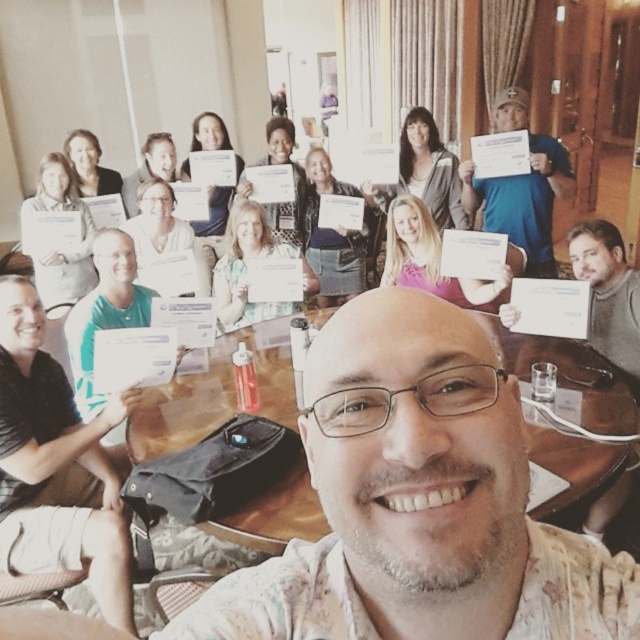
Does black shirt at lower left appear on the right side of green matte shirt at center?

No, black shirt at lower left is not to the right of green matte shirt at center.

Between black shirt at lower left and green matte shirt at center, which one is positioned lower?

black shirt at lower left

Does point (104, 564) come closer to viewer compared to point (93, 252)?

Yes, point (104, 564) is in front of point (93, 252).

Locate an element on the screen. The width and height of the screenshot is (640, 640). black shirt at lower left is located at coordinates (56, 465).

Which is above, blue fabric shirt at upper right or green matte shirt at center?

Positioned higher is blue fabric shirt at upper right.

Is blue fabric shirt at upper right taller than green matte shirt at center?

Yes, blue fabric shirt at upper right is taller than green matte shirt at center.

Locate an element on the screen. blue fabric shirt at upper right is located at coordinates (524, 200).

The image size is (640, 640). Find the location of `blue fabric shirt at upper right`. blue fabric shirt at upper right is located at coordinates (524, 200).

Can you confirm if wooden table at center is positioned below blue fabric shirt at upper right?

Yes, wooden table at center is below blue fabric shirt at upper right.

Is wooden table at center wider than blue fabric shirt at upper right?

Correct, the width of wooden table at center exceeds that of blue fabric shirt at upper right.

I want to click on wooden table at center, so click(x=211, y=397).